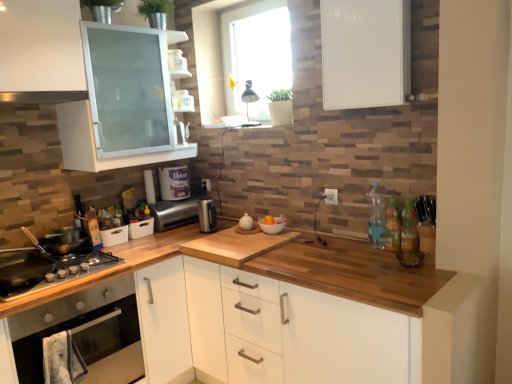
Question: Considering the positions of clear plastic bottle at right, placed as the first bottle when sorted from left to right, and translucent plastic bottles at right, which is counted as the first bottle, starting from the right, in the image, is clear plastic bottle at right, placed as the first bottle when sorted from left to right, bigger or smaller than translucent plastic bottles at right, which is counted as the first bottle, starting from the right,?

Choices:
 (A) small
 (B) big

Answer: (B)

Question: In terms of height, does clear plastic bottle at right, placed as the first bottle when sorted from left to right, look taller or shorter compared to translucent plastic bottles at right, which is counted as the first bottle, starting from the right?

Choices:
 (A) tall
 (B) short

Answer: (A)

Question: Estimate the real-world distances between objects in this image. Which object is farther from the white plastic container at center, which is the 2th appliance in bottom-to-top order?

Choices:
 (A) clear plastic bottle at right, placed as the first bottle when sorted from left to right
 (B) transparent glass window at upper center
 (C) satin silver exhaust hood at upper left
 (D) translucent plastic bottles at right, which is counted as the first bottle, starting from the right
 (E) satin silver toaster at center, placed as the first appliance when sorted from bottom to top

Answer: (D)

Question: Which of these objects is positioned farthest from the stainless steel gas stove at lower left?

Choices:
 (A) stainless steel oven at lower left
 (B) white plastic container at center, which is the 2th appliance in bottom-to-top order
 (C) satin silver toaster at center, which is the second appliance in top-to-bottom order
 (D) translucent plastic bottles at right, which is counted as the first bottle, starting from the right
 (E) wooden at left

Answer: (D)